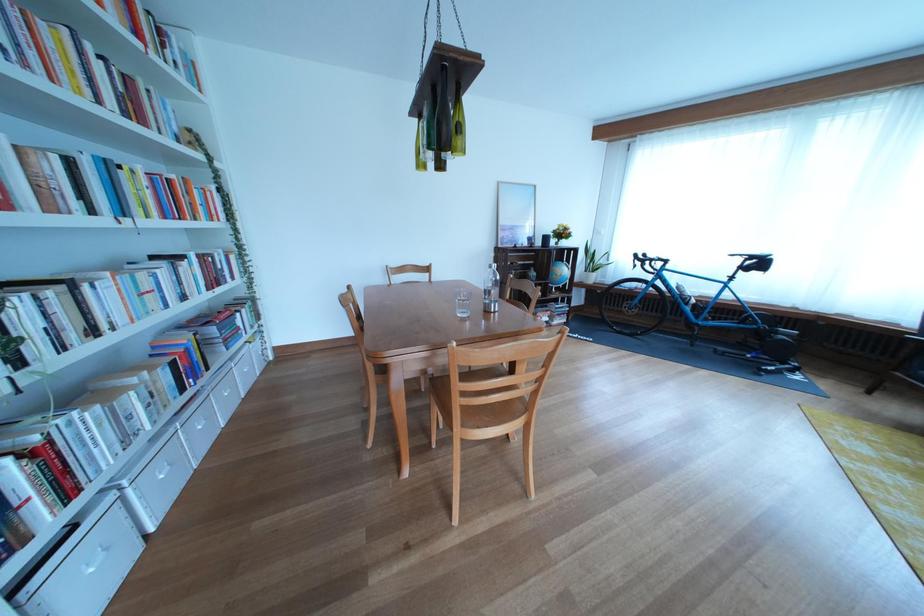
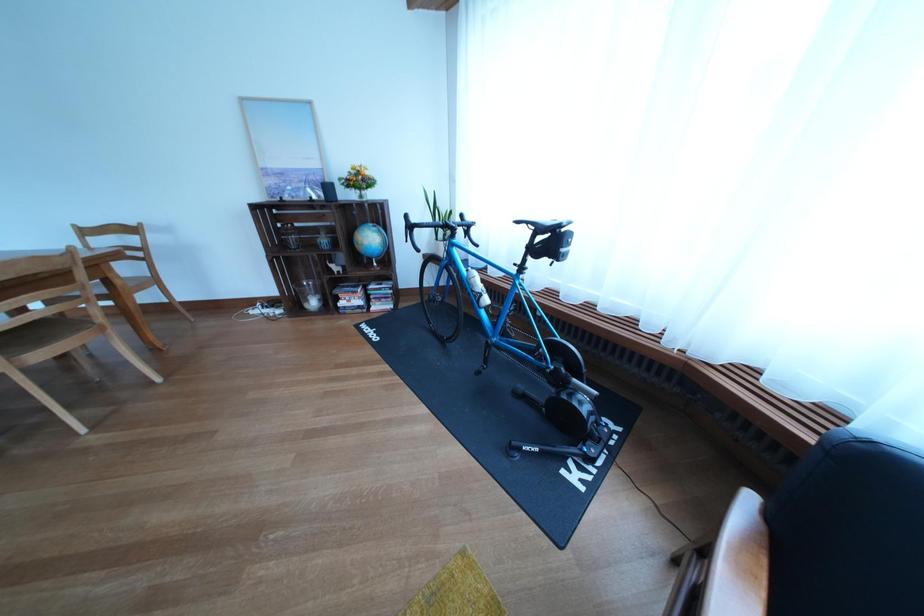
The point at (772, 270) is marked in the first image. Where is the corresponding point in the second image?

(563, 248)